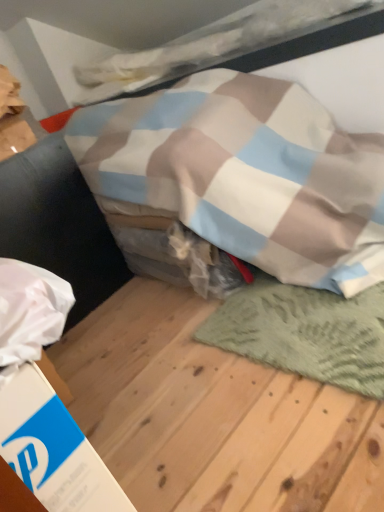
What is the approximate width of green textured rug at lower right?

The width of green textured rug at lower right is 38.43 inches.

You are a GUI agent. You are given a task and a screenshot of the screen. Output one action in this format:
    pyautogui.click(x=<x>, y=<y>)
    Task: Click on the green textured rug at lower right
    This screenshot has width=384, height=512.
    Given the screenshot: What is the action you would take?
    pyautogui.click(x=212, y=415)

The image size is (384, 512). What are the coordinates of `white cardboard box at lower left` in the screenshot? It's located at (53, 449).

The width and height of the screenshot is (384, 512). Describe the element at coordinates (53, 449) in the screenshot. I see `white cardboard box at lower left` at that location.

The image size is (384, 512). In order to click on green textured rug at lower right in this screenshot , I will do `click(212, 415)`.

Does white cardboard box at lower left have a lesser width compared to green textured rug at lower right?

Correct, the width of white cardboard box at lower left is less than that of green textured rug at lower right.

Would you say green textured rug at lower right is part of white cardboard box at lower left's contents?

No, green textured rug at lower right is not inside white cardboard box at lower left.

Visually, is white cardboard box at lower left positioned to the left or to the right of green textured rug at lower right?

white cardboard box at lower left is to the left of green textured rug at lower right.

Are green knitted mat at lower right and green textured rug at lower right far apart?

No, green knitted mat at lower right is not far away from green textured rug at lower right.

Is green knitted mat at lower right facing away from green textured rug at lower right?

Yes, green knitted mat at lower right is facing away from green textured rug at lower right.

Which object is thinner, green knitted mat at lower right or green textured rug at lower right?

Thinner between the two is green knitted mat at lower right.

Is green knitted mat at lower right inside the boundaries of green textured rug at lower right, or outside?

green knitted mat at lower right is contained in green textured rug at lower right.

Considering the relative positions of green textured rug at lower right and green knitted mat at lower right in the image provided, is green textured rug at lower right to the right of green knitted mat at lower right from the viewer's perspective?

No.

Is green knitted mat at lower right at the back of green textured rug at lower right?

Yes, green knitted mat at lower right is at the back of green textured rug at lower right.

Is green textured rug at lower right in front of or behind green knitted mat at lower right in the image?

green textured rug at lower right is in front of green knitted mat at lower right.

Which object is closer to the camera taking this photo, green textured rug at lower right or white cardboard box at lower left?

Positioned in front is green textured rug at lower right.

Is green textured rug at lower right inside or outside of white cardboard box at lower left?

green textured rug at lower right cannot be found inside white cardboard box at lower left.

From a real-world perspective, is green textured rug at lower right under white cardboard box at lower left?

Yes, from a real-world perspective, green textured rug at lower right is beneath white cardboard box at lower left.

From the image's perspective, is green textured rug at lower right over white cardboard box at lower left?

Indeed, from the image's perspective, green textured rug at lower right is shown above white cardboard box at lower left.

Considering the points (301, 329) and (51, 445), which point is in front, point (301, 329) or point (51, 445)?

Positioned in front is point (51, 445).

Between green knitted mat at lower right and white cardboard box at lower left, which one is positioned in front?

white cardboard box at lower left is closer to the camera.

I want to click on cardboard box located below the green knitted mat at lower right (from the image's perspective), so click(x=53, y=449).

Considering the positions of objects green knitted mat at lower right and white cardboard box at lower left in the image provided, who is more to the left, green knitted mat at lower right or white cardboard box at lower left?

From the viewer's perspective, white cardboard box at lower left appears more on the left side.

Considering the sizes of white cardboard box at lower left and green knitted mat at lower right in the image, is white cardboard box at lower left bigger or smaller than green knitted mat at lower right?

Considering their sizes, white cardboard box at lower left takes up less space than green knitted mat at lower right.

Which is in front, point (64, 416) or point (270, 330)?

Point (64, 416)

Is green knitted mat at lower right at the back of white cardboard box at lower left?

No.

Which object is further away from the camera, white cardboard box at lower left or green knitted mat at lower right?

green knitted mat at lower right is further away from the camera.

Locate an element on the screen. cardboard box that is behind the green textured rug at lower right is located at coordinates (53, 449).

Where is `plywood below the green knitted mat at lower right (from a real-world perspective)`? This screenshot has height=512, width=384. plywood below the green knitted mat at lower right (from a real-world perspective) is located at coordinates (212, 415).

Estimate the real-world distances between objects in this image. Which object is closer to white cardboard box at lower left, green knitted mat at lower right or green textured rug at lower right?

green textured rug at lower right.

Estimate the real-world distances between objects in this image. Which object is closer to green textured rug at lower right, white cardboard box at lower left or green knitted mat at lower right?

green knitted mat at lower right is closer to green textured rug at lower right.

When comparing their distances from green knitted mat at lower right, does green textured rug at lower right or white cardboard box at lower left seem further?

The object further to green knitted mat at lower right is white cardboard box at lower left.

Based on their spatial positions, is green textured rug at lower right or green knitted mat at lower right closer to white cardboard box at lower left?

green textured rug at lower right.

Considering their positions, is white cardboard box at lower left positioned closer to green knitted mat at lower right than green textured rug at lower right?

green textured rug at lower right is closer to green knitted mat at lower right.

Looking at the image, which one is located closer to green textured rug at lower right, green knitted mat at lower right or white cardboard box at lower left?

green knitted mat at lower right lies closer to green textured rug at lower right than the other object.

Locate an element on the screen. plywood between white cardboard box at lower left and green knitted mat at lower right from left to right is located at coordinates click(x=212, y=415).